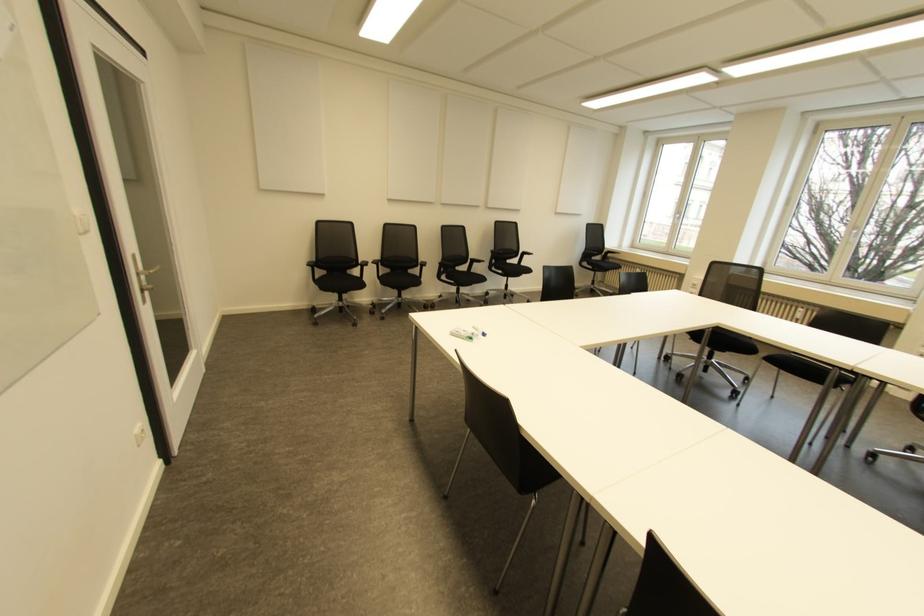
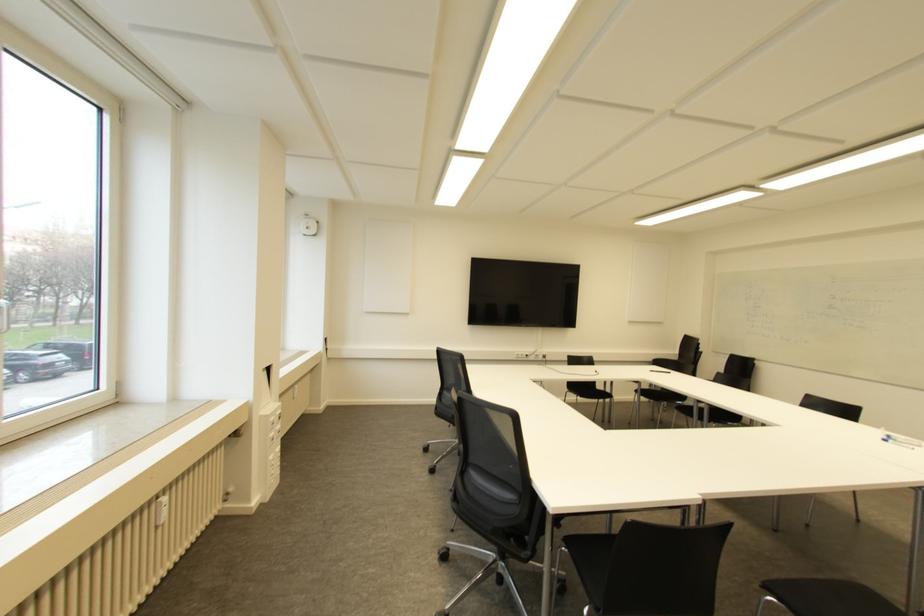
Where in the second image is the point corresponding to (800,309) from the first image?

(163, 499)